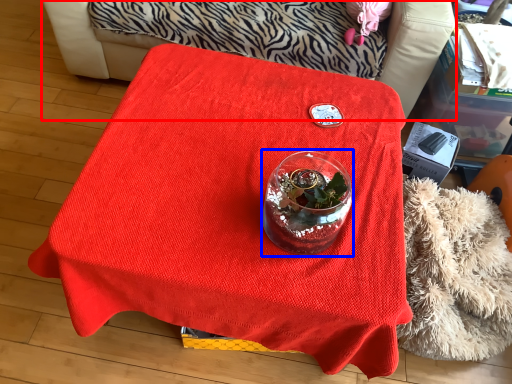
Question: Which point is closer to the camera, furniture (highlighted by a red box) or glass vase (highlighted by a blue box)?

Choices:
 (A) furniture
 (B) glass vase

Answer: (B)